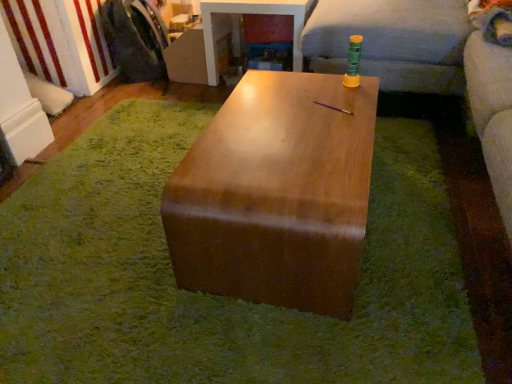
Identify the location of vacant space in front of brushed metal washing machine at left. The height and width of the screenshot is (384, 512). (142, 91).